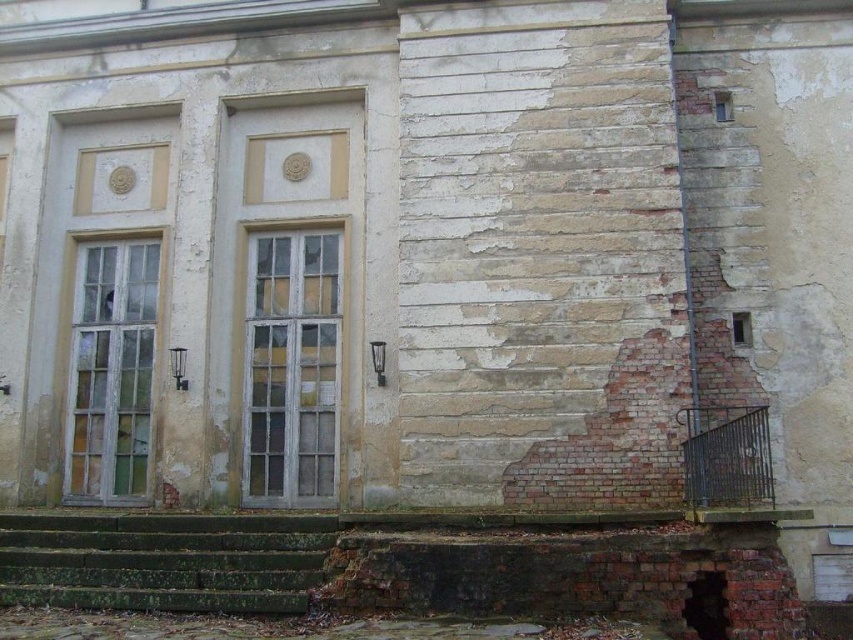
Can you confirm if white weathered wood window at center is smaller than wooden glass window at left?

Yes, white weathered wood window at center is smaller than wooden glass window at left.

You are a GUI agent. You are given a task and a screenshot of the screen. Output one action in this format:
    pyautogui.click(x=<x>, y=<y>)
    Task: Click on the white weathered wood window at center
    
    Given the screenshot: What is the action you would take?
    click(x=291, y=369)

Between green mossy stone stairs at lower left and wooden glass window at left, which one is positioned higher?

wooden glass window at left is higher up.

Who is shorter, green mossy stone stairs at lower left or wooden glass window at left?

green mossy stone stairs at lower left

Between point (164, 547) and point (96, 404), which one is positioned in front?

Point (164, 547) is in front.

I want to click on green mossy stone stairs at lower left, so click(163, 561).

Who is taller, green mossy stone stairs at lower left or white weathered wood window at center?

With more height is white weathered wood window at center.

Consider the image. Who is more distant from viewer, (151, 593) or (328, 396)?

Point (328, 396)

In order to click on green mossy stone stairs at lower left in this screenshot , I will do `click(163, 561)`.